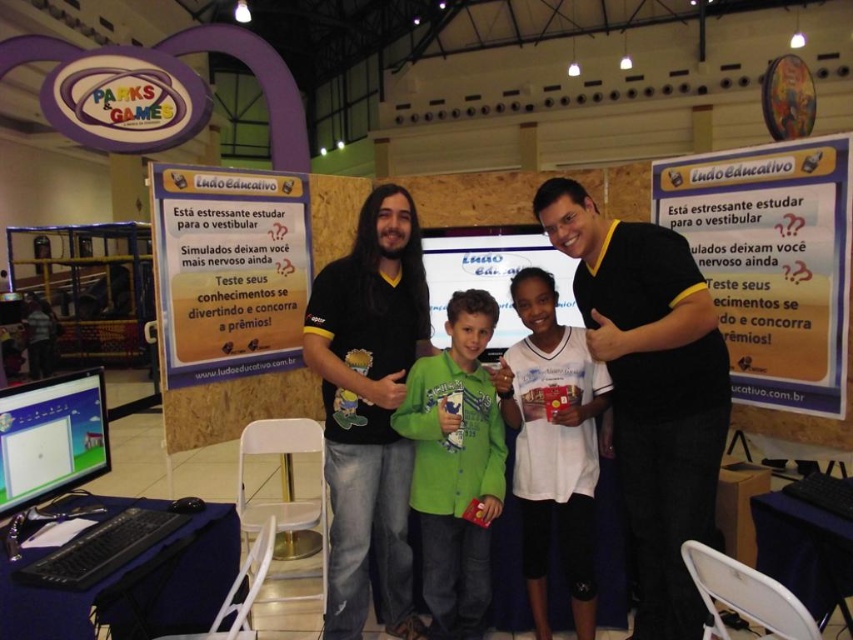
Question: Estimate the real-world distances between objects in this image. Which object is farther from the matte plastic computer screen at center?

Choices:
 (A) green matte shirt at center
 (B) matte black shirt at center

Answer: (B)

Question: Is black/yellow t-shirt at center thinner than green matte shirt at center?

Choices:
 (A) yes
 (B) no

Answer: (B)

Question: Can you confirm if black matte shirt at center is smaller than green matte shirt at center?

Choices:
 (A) yes
 (B) no

Answer: (B)

Question: Is green matte shirt at center to the left of matte plastic computer screen at lower left from the viewer's perspective?

Choices:
 (A) no
 (B) yes

Answer: (A)

Question: Which object appears farthest from the camera in this image?

Choices:
 (A) black/yellow t-shirt at center
 (B) matte plastic computer screen at center

Answer: (B)

Question: Which object is closer to the camera taking this photo?

Choices:
 (A) black matte shirt at center
 (B) matte plastic computer screen at center

Answer: (A)